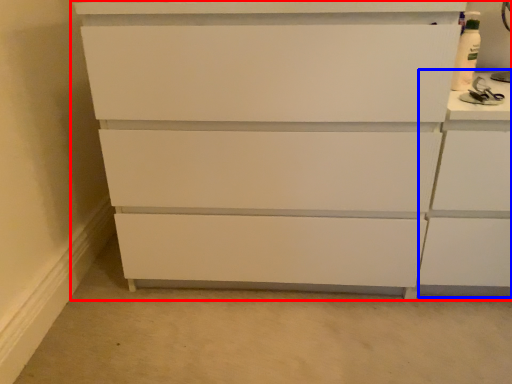
Question: Among these objects, which one is farthest to the camera, chest of drawers (highlighted by a red box) or cabinetry (highlighted by a blue box)?

Choices:
 (A) chest of drawers
 (B) cabinetry

Answer: (B)